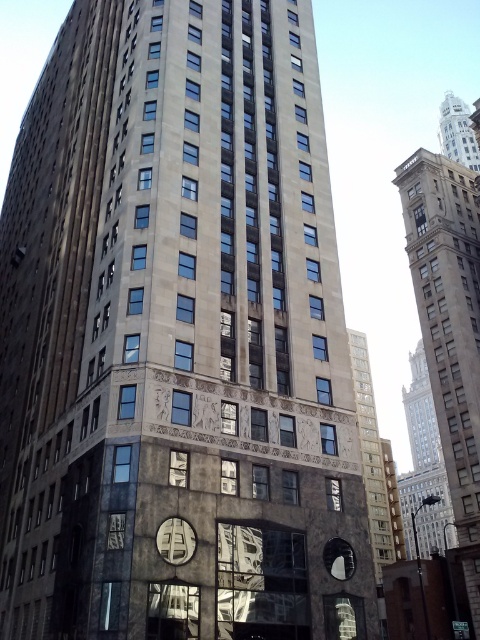
Is beige stone tower at right wider than gray stone clock at center?

Yes.

Between beige stone tower at right and gray stone clock at center, which one is positioned lower?

gray stone clock at center

What do you see at coordinates (450, 326) in the screenshot? I see `beige stone tower at right` at bounding box center [450, 326].

What are the coordinates of `beige stone tower at right` in the screenshot? It's located at (450, 326).

Between white marble clock tower at upper right and gray stone clock at center, which one is positioned higher?

white marble clock tower at upper right is above.

Is white marble clock tower at upper right further to the viewer compared to gray stone clock at center?

That is True.

Is point (478, 170) positioned in front of point (171, 532)?

No.

You are a GUI agent. You are given a task and a screenshot of the screen. Output one action in this format:
    pyautogui.click(x=<x>, y=<y>)
    Task: Click on the white marble clock tower at upper right
    Image resolution: width=480 pixels, height=640 pixels.
    Given the screenshot: What is the action you would take?
    pyautogui.click(x=457, y=132)

From the picture: Which is above, marble-like stone tower at center or white marble clock tower at upper right?

white marble clock tower at upper right is above.

Is marble-like stone tower at center behind white marble clock tower at upper right?

No.

Where is `marble-like stone tower at center`? The width and height of the screenshot is (480, 640). marble-like stone tower at center is located at coordinates (375, 465).

This screenshot has width=480, height=640. In order to click on marble-like stone tower at center in this screenshot , I will do `click(375, 465)`.